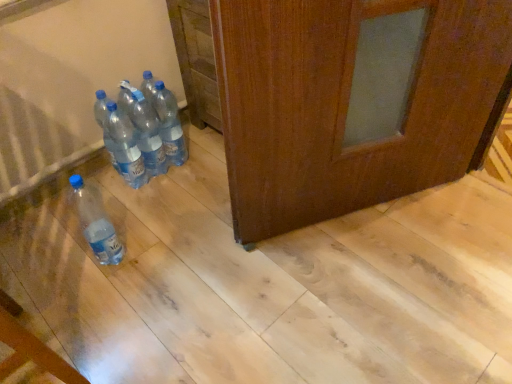
Where is `free point behind matte plastic bottle at lower left, marked as the 1th bottle in a left-to-right arrangement`? Image resolution: width=512 pixels, height=384 pixels. free point behind matte plastic bottle at lower left, marked as the 1th bottle in a left-to-right arrangement is located at coordinates (132, 216).